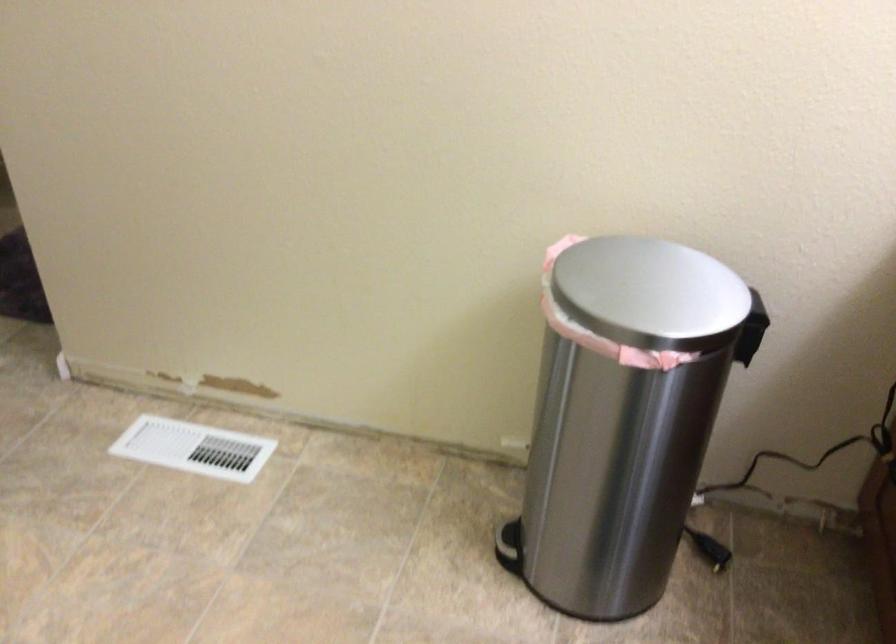
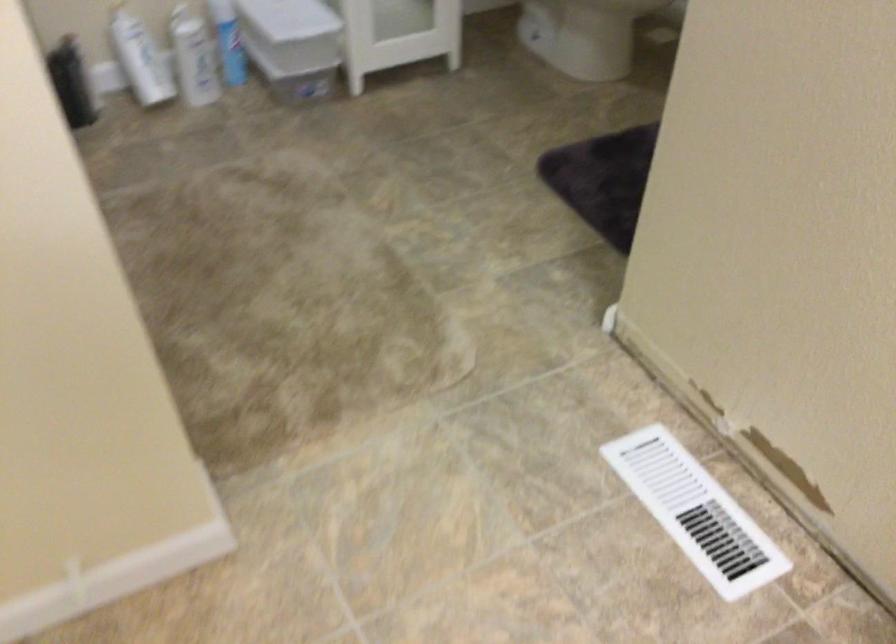
Based on the continuous images, in which direction is the camera rotating?

The camera's rotation is toward left-down.